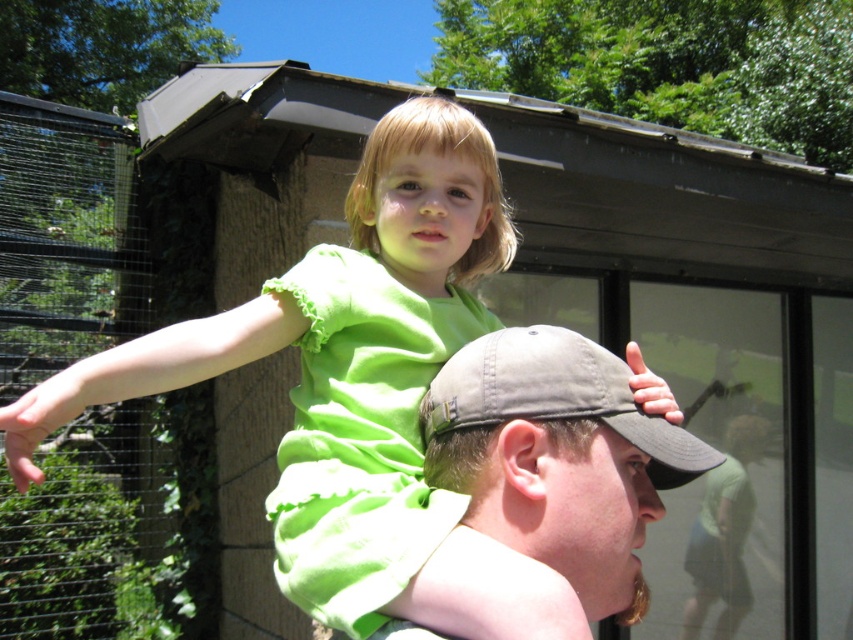
Question: Which of the following is the farthest from the observer?

Choices:
 (A) (500, 436)
 (B) (12, 435)
 (C) (750, 445)
 (D) (675, 451)

Answer: (C)

Question: Among these points, which one is nearest to the camera?

Choices:
 (A) (393, 353)
 (B) (561, 340)
 (C) (548, 522)
 (D) (693, 538)

Answer: (C)

Question: Does matte khaki cap at center have a larger size compared to green fabric shirt at upper center?

Choices:
 (A) no
 (B) yes

Answer: (A)

Question: Can you confirm if khaki fabric baseball cap at upper center is wider than green fabric shirt at upper center?

Choices:
 (A) yes
 (B) no

Answer: (B)

Question: Which point is closer to the camera taking this photo?

Choices:
 (A) (585, 499)
 (B) (277, 339)

Answer: (A)

Question: Is matte khaki cap at center further to camera compared to green fabric shirt at upper center?

Choices:
 (A) no
 (B) yes

Answer: (A)